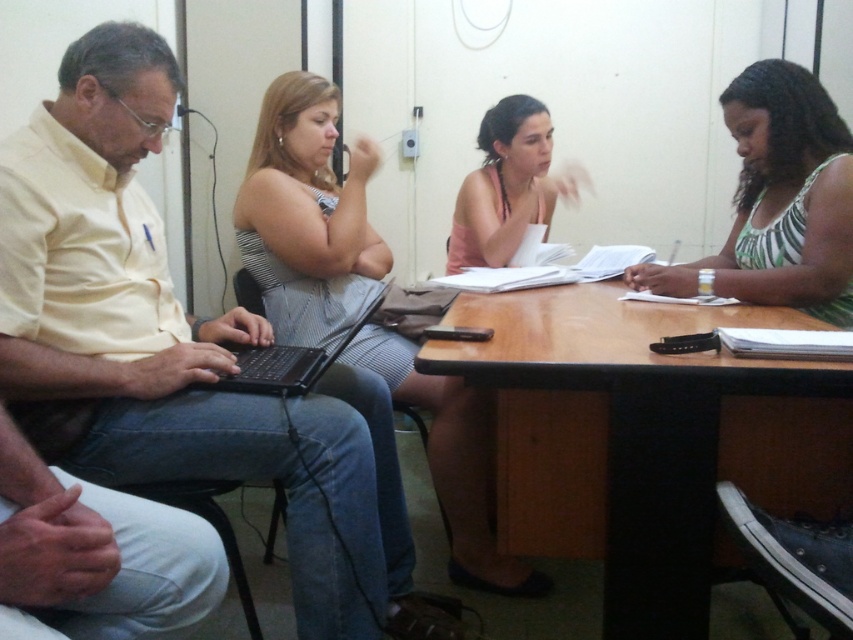
What is the relationship between the width of the striped fabric dress at center and the green striped tank top at right?

The striped fabric dress at center is wider than the green striped tank top at right.

You are sitting at the brown wood table at center and need to reach the black plastic laptop at left. Can you comfortably reach it without moving your chair?

The brown wood table at center is 45.94 centimeters away from the black plastic laptop at left. Since this distance is relatively short, you can comfortably reach it without needing to move your chair.

What object is located at the coordinate point (x=645, y=440) in the image?

The point at (x=645, y=440) corresponds to the brown wood table at center.